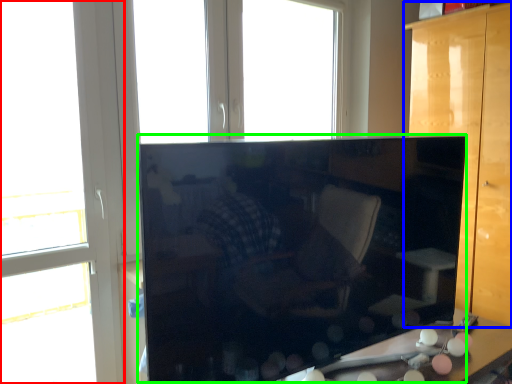
Question: Considering the real-world distances, which object is closest to window (highlighted by a red box)? furniture (highlighted by a blue box) or cabinetry (highlighted by a green box).

Choices:
 (A) furniture
 (B) cabinetry

Answer: (B)